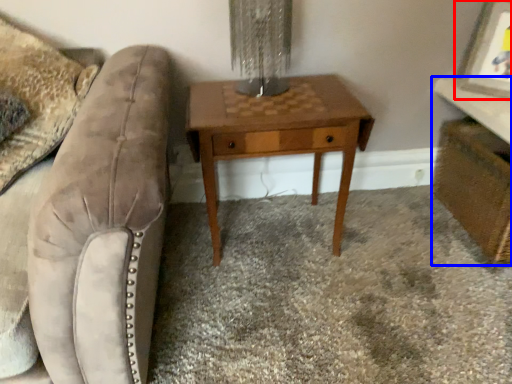
Question: Among these objects, which one is farthest to the camera, picture frame (highlighted by a red box) or vanity (highlighted by a blue box)?

Choices:
 (A) picture frame
 (B) vanity

Answer: (A)